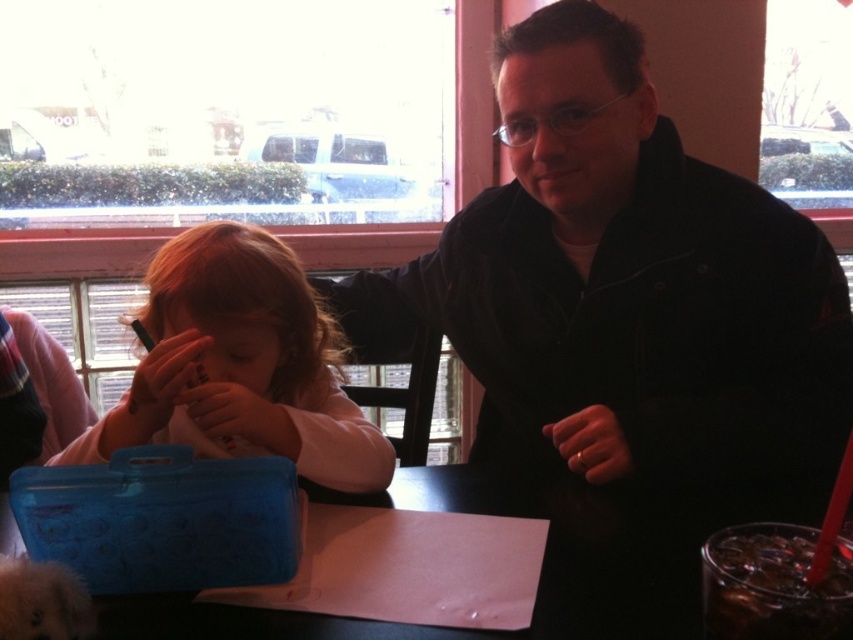
Question: Is black matte jacket at center positioned at the back of matte white hand at center?

Choices:
 (A) yes
 (B) no

Answer: (A)

Question: Which point is closer to the camera?

Choices:
 (A) matte white hand at center
 (B) clear glass drink at lower right
 (C) matte blue pencil case at left

Answer: (B)

Question: Which of the following is the closest to the observer?

Choices:
 (A) clear glass drink at lower right
 (B) black matte jacket at center
 (C) matte white hand at center

Answer: (A)

Question: Which of the following is the closest to the observer?

Choices:
 (A) matte blue pencil case at left
 (B) clear glass drink at lower right
 (C) black matte jacket at center

Answer: (B)

Question: Considering the relative positions of black glossy table at center and clear glass drink at lower right in the image provided, where is black glossy table at center located with respect to clear glass drink at lower right?

Choices:
 (A) left
 (B) right

Answer: (A)

Question: Is black glossy table at center thinner than clear glass drink at lower right?

Choices:
 (A) yes
 (B) no

Answer: (B)